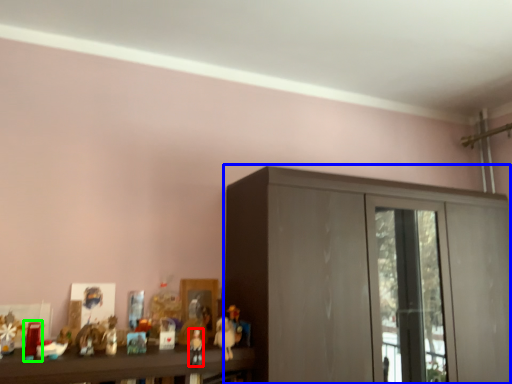
Question: Which object is positioned farthest from toy (highlighted by a red box)? Select from cupboard (highlighted by a blue box) and toy (highlighted by a green box).

Choices:
 (A) cupboard
 (B) toy

Answer: (A)